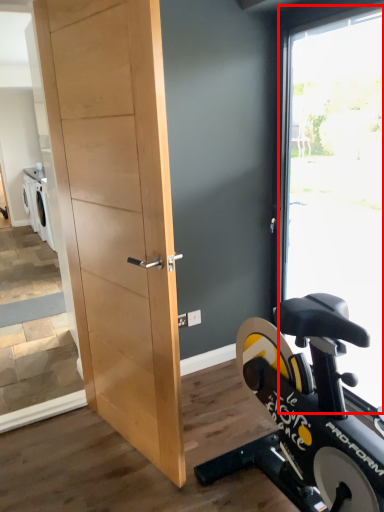
Question: From the image's perspective, considering the relative positions of window (annotated by the red box) and barn door in the image provided, where is window (annotated by the red box) located with respect to the staircase?

Choices:
 (A) above
 (B) below

Answer: (A)